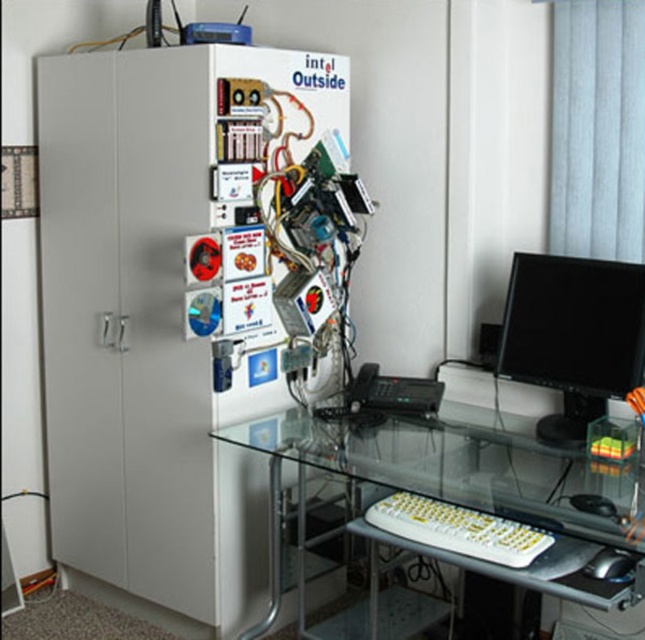
You are organizing a small party in your home office and need to place a cake on the white matte refrigerator at left. The cake requires a flat surface area of 0.3 square meters. Can the refrigerator provide enough space for the cake?

The white matte refrigerator at left has a surface area that can be calculated using its dimensions. However, since the coordinates provided are its position and not its size, we cannot determine the surface area from the given information. Therefore, it is unclear if the refrigerator has enough space for the cake.